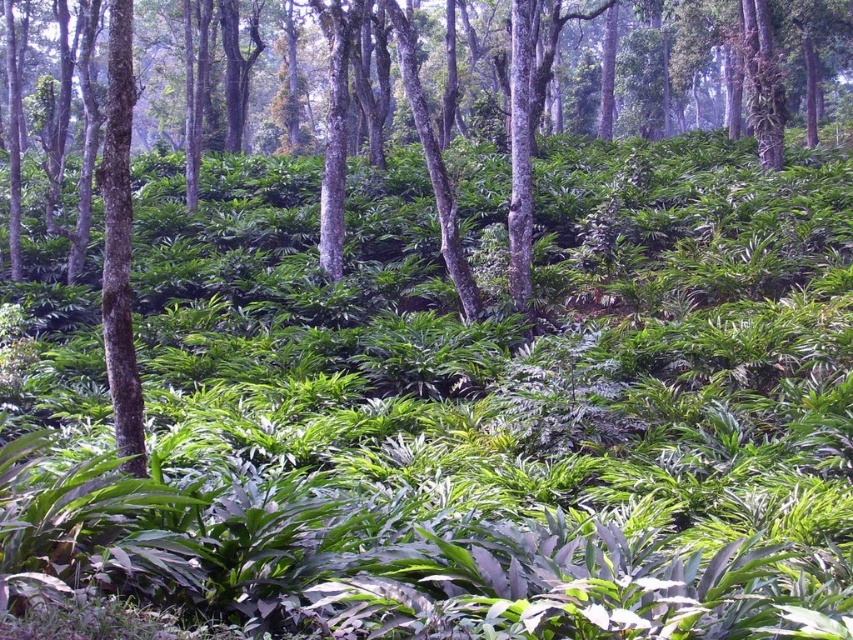
Does point (363, 424) come in front of point (111, 323)?

No.

Does green leafy plant at center have a larger size compared to smooth bark tree at left?

Indeed, green leafy plant at center has a larger size compared to smooth bark tree at left.

Who is more distant from viewer, [241,372] or [112,29]?

The point [241,372] is more distant.

Identify the location of green leafy plant at center. (451, 269).